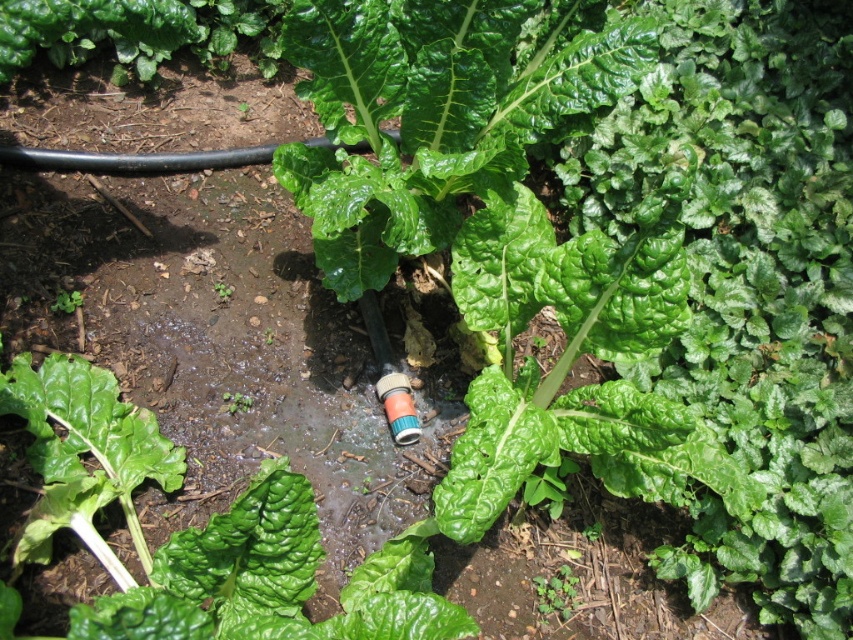
You are a gardener checking the growth of the plants in the garden. You see the green leafy plant at upper left and the green leafy plant at lower left. Which one is taller?

The green leafy plant at upper left is taller than the green leafy plant at lower left.

You are a gardener who needs to water the green leafy plant at upper left. The sprinkler is located at the center of the garden. Based on the coordinates provided, will the sprinkler reach the plant?

The green leafy plant at upper left is located at coordinates point [135,29]. Since the sprinkler is at the center of the garden, it is unlikely to reach the plant as the coordinates suggest the plant is positioned near the upper left corner, far from the center.